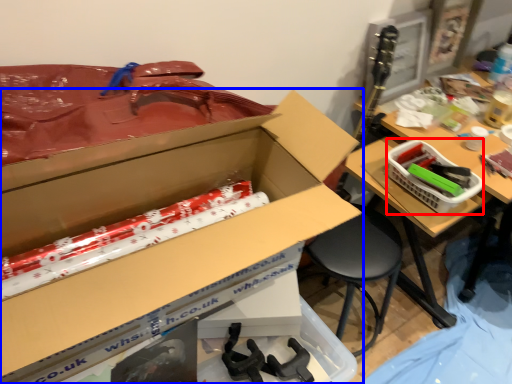
Question: Which point is closer to the camera, basket (highlighted by a red box) or box (highlighted by a blue box)?

Choices:
 (A) basket
 (B) box

Answer: (B)